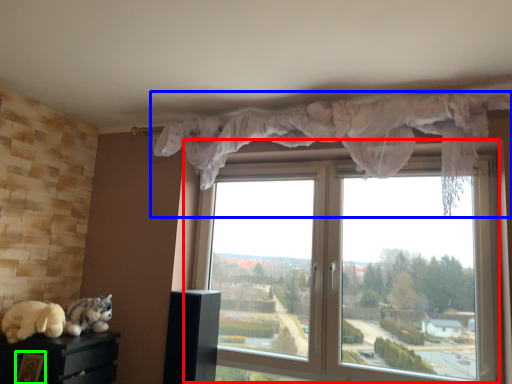
Question: Which object is the farthest from window (highlighted by a red box)? Choose among these: curtain (highlighted by a blue box) or picture frame (highlighted by a green box).

Choices:
 (A) curtain
 (B) picture frame

Answer: (B)